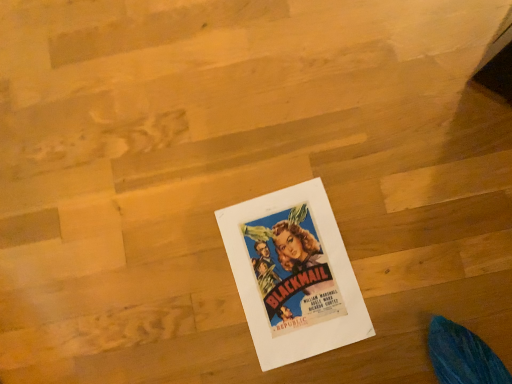
Identify the location of matte paper poster at center. Image resolution: width=512 pixels, height=384 pixels. (293, 274).

Describe the element at coordinates (293, 274) in the screenshot. I see `matte paper poster at center` at that location.

In order to face matte paper poster at center, should I rotate leftwards or rightwards?

You should rotate right by 5.193 degrees.

At what (x,y) coordinates should I click in order to perform the action: click on matte paper poster at center. Please return your answer as a coordinate pair (x, y). Looking at the image, I should click on (293, 274).